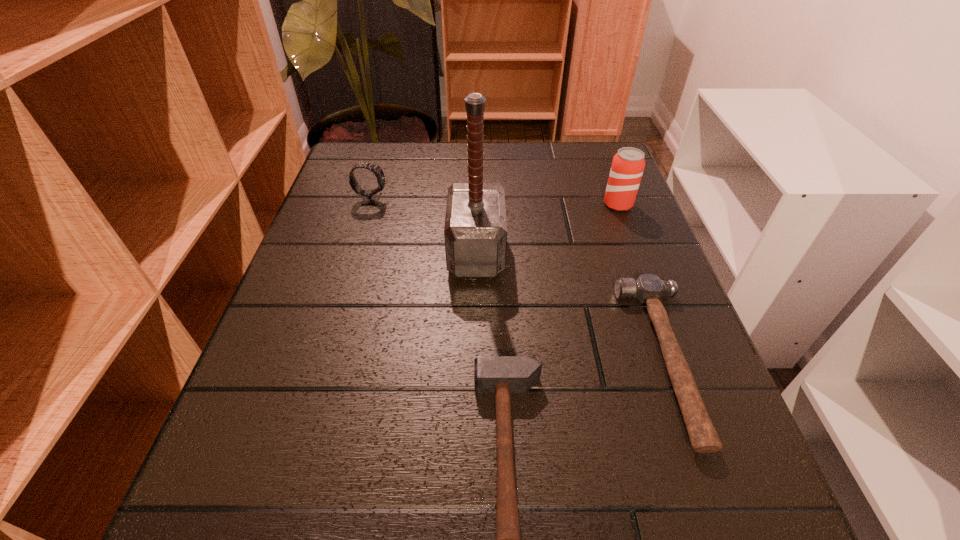
Identify the location of vacant area situated 0.370m on the striking face of the rightmost hammer. (403, 359).

This screenshot has height=540, width=960. Find the location of `free space located 0.100m on the striking face of the rightmost hammer`. free space located 0.100m on the striking face of the rightmost hammer is located at coordinates (571, 359).

What are the coordinates of `object that is at the left edge` in the screenshot? It's located at (369, 198).

Locate an element on the screen. The height and width of the screenshot is (540, 960). beer can that is at the right edge is located at coordinates (628, 164).

At what (x,y) coordinates should I click in order to perform the action: click on hammer present at the right edge. Please return your answer as a coordinate pair (x, y). This screenshot has width=960, height=540. Looking at the image, I should click on (648, 288).

Identify the location of free location at the far edge of the desktop. This screenshot has width=960, height=540. (495, 143).

Find the location of `free space at the near edge of the desktop`. free space at the near edge of the desktop is located at coordinates (546, 491).

I want to click on blank area at the left edge, so click(279, 309).

Identify the location of vacant space at the right edge of the desktop. Image resolution: width=960 pixels, height=540 pixels. pyautogui.click(x=705, y=457).

In the image, there is a desktop. Find the location of `vacant space at the far left corner`. vacant space at the far left corner is located at coordinates (359, 153).